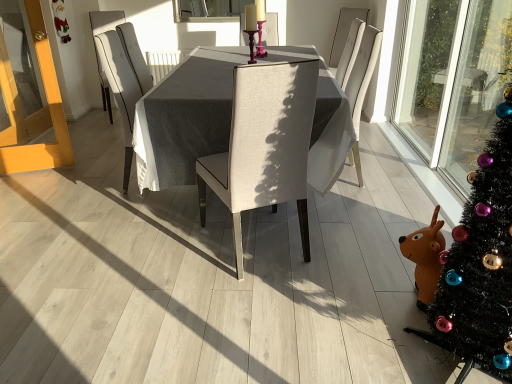
You are a GUI agent. You are given a task and a screenshot of the screen. Output one action in this format:
    pyautogui.click(x=<x>, y=<y>)
    Task: Click on the black artificial christmas tree at right
    
    Given the screenshot: What is the action you would take?
    pyautogui.click(x=480, y=264)

This screenshot has height=384, width=512. Describe the element at coordinates (185, 117) in the screenshot. I see `textured gray table at center` at that location.

Describe the element at coordinates (264, 146) in the screenshot. I see `beige fabric chair at center, the second chair viewed from the left` at that location.

Where is `beige fabric chair at center, which is counted as the 3th chair, starting from the back`? Image resolution: width=512 pixels, height=384 pixels. beige fabric chair at center, which is counted as the 3th chair, starting from the back is located at coordinates (264, 146).

Measure the distance between point (237,9) and camera.

They are 4.58 meters apart.

Where is `clear glass window screen at upper center`? The width and height of the screenshot is (512, 384). clear glass window screen at upper center is located at coordinates (208, 9).

The image size is (512, 384). What are the coordinates of `light wood screen door at left` in the screenshot? It's located at (49, 110).

From a real-world perspective, is white fabric chair at center, which ranks as the 3th chair in right-to-left order, below black artificial christmas tree at right?

Yes, from a real-world perspective, white fabric chair at center, which ranks as the 3th chair in right-to-left order, is below black artificial christmas tree at right.

How many degrees apart are the facing directions of white fabric chair at center, which ranks as the 3th chair in right-to-left order, and black artificial christmas tree at right?

The facing directions of white fabric chair at center, which ranks as the 3th chair in right-to-left order, and black artificial christmas tree at right are 121 degrees apart.

Where is `christmas tree above the white fabric chair at center, positioned as the third chair in front-to-back order (from a real-world perspective)`? christmas tree above the white fabric chair at center, positioned as the third chair in front-to-back order (from a real-world perspective) is located at coordinates (480, 264).

Is white fabric chair at center, which ranks as the 3th chair in right-to-left order, directly adjacent to black artificial christmas tree at right?

white fabric chair at center, which ranks as the 3th chair in right-to-left order, is not next to black artificial christmas tree at right, and they're not touching.

Does black artificial christmas tree at right turn towards white fabric chair at center, positioned as the third chair in front-to-back order?

No, black artificial christmas tree at right is not facing towards white fabric chair at center, positioned as the third chair in front-to-back order.

From a real-world perspective, is black artificial christmas tree at right located higher than white fabric chair at center, positioned as the third chair in front-to-back order?

Yes, from a real-world perspective, black artificial christmas tree at right is on top of white fabric chair at center, positioned as the third chair in front-to-back order.

Is black artificial christmas tree at right to the right of white fabric chair at center, arranged as the 1th chair when viewed from the back, from the viewer's perspective?

Indeed, black artificial christmas tree at right is positioned on the right side of white fabric chair at center, arranged as the 1th chair when viewed from the back.

From the image's perspective, between black artificial christmas tree at right and white fabric chair at center, positioned as the third chair in front-to-back order, which one is located above?

white fabric chair at center, positioned as the third chair in front-to-back order.

Where is `the 3rd chair counting from the right of the light wood screen door at left`? This screenshot has height=384, width=512. the 3rd chair counting from the right of the light wood screen door at left is located at coordinates (358, 77).

Is light wood screen door at left placed right next to light beige fabric chair at center, the second chair viewed from the back?

No, light wood screen door at left is not with light beige fabric chair at center, the second chair viewed from the back.

Considering the positions of points (7, 169) and (339, 71), is point (7, 169) farther from camera compared to point (339, 71)?

No, (7, 169) is in front of (339, 71).

Does light wood screen door at left lie behind light beige fabric chair at center, the second chair viewed from the back?

Yes.

Could you tell me if clear glass window screen at upper center is facing light beige fabric chair at center, the third chair positioned from the left?

No, clear glass window screen at upper center is not facing towards light beige fabric chair at center, the third chair positioned from the left.

From the image's perspective, is clear glass window screen at upper center above light beige fabric chair at center, the third chair positioned from the left?

Yes, from the image's perspective, clear glass window screen at upper center is above light beige fabric chair at center, the third chair positioned from the left.

Considering the relative positions of clear glass window screen at upper center and light beige fabric chair at center, which ranks as the 2th chair in front-to-back order, in the image provided, is clear glass window screen at upper center to the right of light beige fabric chair at center, which ranks as the 2th chair in front-to-back order, from the viewer's perspective?

Incorrect, clear glass window screen at upper center is not on the right side of light beige fabric chair at center, which ranks as the 2th chair in front-to-back order.

Considering the positions of point (210, 9) and point (343, 82), is point (210, 9) closer or farther from the camera than point (343, 82)?

Clearly, point (210, 9) is more distant from the camera than point (343, 82).

Is textured gray table at center surrounded by light wood screen door at left?

That's incorrect, textured gray table at center is not inside light wood screen door at left.

Is light wood screen door at left directly adjacent to textured gray table at center?

No, light wood screen door at left is not in contact with textured gray table at center.

In the image, there is a light wood screen door at left. Where is `table below it (from the image's perspective)`? table below it (from the image's perspective) is located at coordinates (185, 117).

Is light wood screen door at left taller than textured gray table at center?

Yes.

Which is in front, point (211, 11) or point (118, 12)?

Point (118, 12)

Which object is further away from the camera, clear glass window screen at upper center or white fabric chair at center, arranged as the 1th chair when viewed from the left?

clear glass window screen at upper center is further from the camera.

Could you tell me if clear glass window screen at upper center is turned towards white fabric chair at center, arranged as the 1th chair when viewed from the back?

No, clear glass window screen at upper center is not aimed at white fabric chair at center, arranged as the 1th chair when viewed from the back.

Is clear glass window screen at upper center located outside white fabric chair at center, arranged as the 1th chair when viewed from the back?

clear glass window screen at upper center is positioned outside white fabric chair at center, arranged as the 1th chair when viewed from the back.

Is beige fabric chair at center, the second chair viewed from the left, outside of black artificial christmas tree at right?

Absolutely, beige fabric chair at center, the second chair viewed from the left, is external to black artificial christmas tree at right.

From the image's perspective, which one is positioned lower, beige fabric chair at center, which is counted as the 3th chair, starting from the back, or black artificial christmas tree at right?

From the image's view, black artificial christmas tree at right is below.

Consider the image. From a real-world perspective, between beige fabric chair at center, the first chair from the front, and black artificial christmas tree at right, who is vertically higher?

black artificial christmas tree at right.

Is beige fabric chair at center, the second chair viewed from the left, positioned with its back to black artificial christmas tree at right?

No.

You are a GUI agent. You are given a task and a screenshot of the screen. Output one action in this format:
    pyautogui.click(x=<x>, y=<y>)
    Task: Click on the christmas tree on the right of white fabric chair at center, arranged as the 1th chair when viewed from the back
    This screenshot has height=384, width=512.
    Given the screenshot: What is the action you would take?
    pyautogui.click(x=480, y=264)

Starting from the black artificial christmas tree at right, which chair is the 3rd one to the left? Please provide its 2D coordinates.

[(97, 50)]

When comparing their distances from clear glass window screen at upper center, does light beige fabric chair at center, the second chair viewed from the back, or white fabric chair at center, arranged as the 1th chair when viewed from the left, seem closer?

white fabric chair at center, arranged as the 1th chair when viewed from the left, is closer to clear glass window screen at upper center.

Looking at the image, which one is located further to clear glass window screen at upper center, light wood screen door at left or beige fabric chair at center, the 2th chair from the right?

beige fabric chair at center, the 2th chair from the right, is positioned further to the anchor clear glass window screen at upper center.

In the scene shown: Considering their positions, is clear glass window screen at upper center positioned closer to light beige fabric chair at center, which ranks as the 2th chair in front-to-back order, than textured gray table at center?

textured gray table at center lies closer to light beige fabric chair at center, which ranks as the 2th chair in front-to-back order, than the other object.

Looking at the image, which one is located further to beige fabric chair at center, the first chair from the front, clear glass window screen at upper center or black artificial christmas tree at right?

clear glass window screen at upper center lies further to beige fabric chair at center, the first chair from the front, than the other object.

From the image, which object appears to be nearer to light beige fabric chair at center, the third chair positioned from the left, white fabric chair at center, arranged as the 1th chair when viewed from the left, or clear glass window screen at upper center?

Based on the image, clear glass window screen at upper center appears to be nearer to light beige fabric chair at center, the third chair positioned from the left.

When comparing their distances from beige fabric chair at center, which is counted as the 3th chair, starting from the back, does white fabric chair at center, arranged as the 1th chair when viewed from the back, or light beige fabric chair at center, which ranks as the 2th chair in front-to-back order, seem further?

white fabric chair at center, arranged as the 1th chair when viewed from the back, is further to beige fabric chair at center, which is counted as the 3th chair, starting from the back.

From the image, which object appears to be farther from clear glass window screen at upper center, light beige fabric chair at center, the third chair positioned from the left, or beige fabric chair at center, which is counted as the 3th chair, starting from the back?

beige fabric chair at center, which is counted as the 3th chair, starting from the back, is further to clear glass window screen at upper center.

Looking at this image, when comparing their distances from textured gray table at center, does light beige fabric chair at center, acting as the 1th chair starting from the right, or white fabric chair at center, which ranks as the 3th chair in right-to-left order, seem further?

white fabric chair at center, which ranks as the 3th chair in right-to-left order, lies further to textured gray table at center than the other object.

Where is `screen door located between light beige fabric chair at center, the third chair positioned from the left, and clear glass window screen at upper center in the depth direction`? The image size is (512, 384). screen door located between light beige fabric chair at center, the third chair positioned from the left, and clear glass window screen at upper center in the depth direction is located at coordinates (49, 110).

The height and width of the screenshot is (384, 512). I want to click on table between black artificial christmas tree at right and white fabric chair at center, arranged as the 1th chair when viewed from the left, along the z-axis, so click(185, 117).

The height and width of the screenshot is (384, 512). In order to click on screen door located between black artificial christmas tree at right and white fabric chair at center, arranged as the 1th chair when viewed from the back, in the depth direction in this screenshot , I will do `click(49, 110)`.

The width and height of the screenshot is (512, 384). Find the location of `table between beige fabric chair at center, the second chair viewed from the left, and clear glass window screen at upper center from front to back`. table between beige fabric chair at center, the second chair viewed from the left, and clear glass window screen at upper center from front to back is located at coordinates (185, 117).